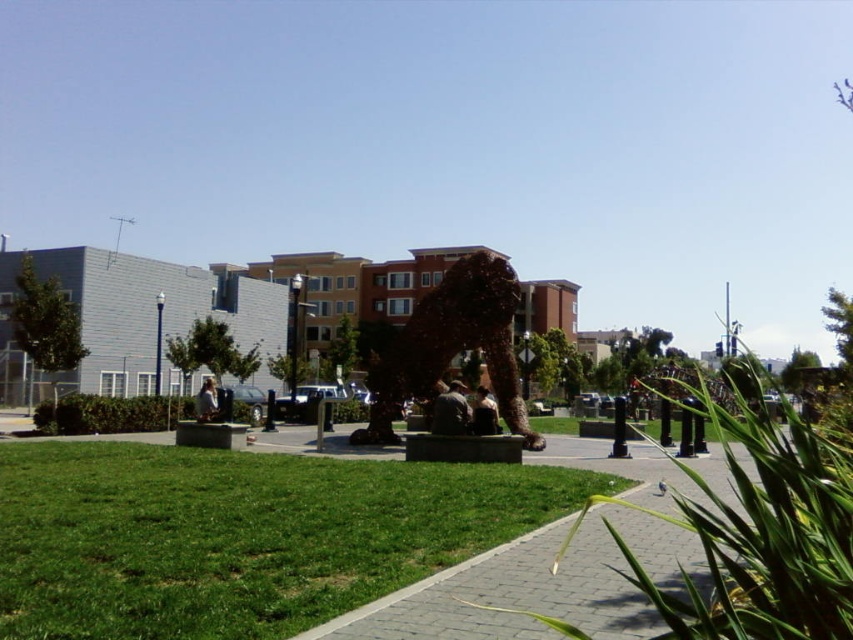
Question: Which point is farther to the camera?

Choices:
 (A) (532, 563)
 (B) (399, 349)
 (C) (248, 538)

Answer: (B)

Question: Considering the relative positions of green grass at lower left and brick paved walkway at center in the image provided, where is green grass at lower left located with respect to brick paved walkway at center?

Choices:
 (A) above
 (B) below

Answer: (A)

Question: Which point is closer to the camera?

Choices:
 (A) (492, 621)
 (B) (90, 468)

Answer: (A)

Question: Can you confirm if green grass at lower left is bigger than brick paved walkway at center?

Choices:
 (A) yes
 (B) no

Answer: (B)

Question: Does brick paved walkway at center lie in front of brown textured sculpture at center?

Choices:
 (A) yes
 (B) no

Answer: (A)

Question: Which of the following is the farthest from the observer?

Choices:
 (A) (491, 307)
 (B) (451, 576)
 (C) (155, 589)

Answer: (A)